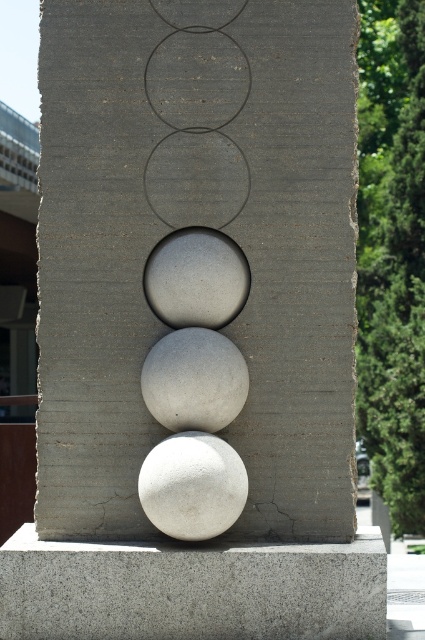
Question: Does gray rough concrete at bottom lie behind white matte sphere at center?

Choices:
 (A) yes
 (B) no

Answer: (A)

Question: Is gray rough concrete at bottom bigger than smooth concrete circle at center?

Choices:
 (A) no
 (B) yes

Answer: (B)

Question: Which of the following is the farthest from the observer?

Choices:
 (A) smooth concrete circle at center
 (B) gray rough sphere at center
 (C) gray stone sphere at center
 (D) white matte sphere at center

Answer: (A)

Question: Based on their relative distances, which object is farther from the matte concrete circle at upper center?

Choices:
 (A) white matte sphere at center
 (B) smooth concrete spheres at center

Answer: (A)

Question: Which of the following is the closest to the observer?

Choices:
 (A) (353, 492)
 (B) (241, 461)
 (C) (144, 179)

Answer: (B)

Question: Is gray rough concrete at bottom to the left of gray rough sphere at center from the viewer's perspective?

Choices:
 (A) yes
 (B) no

Answer: (B)